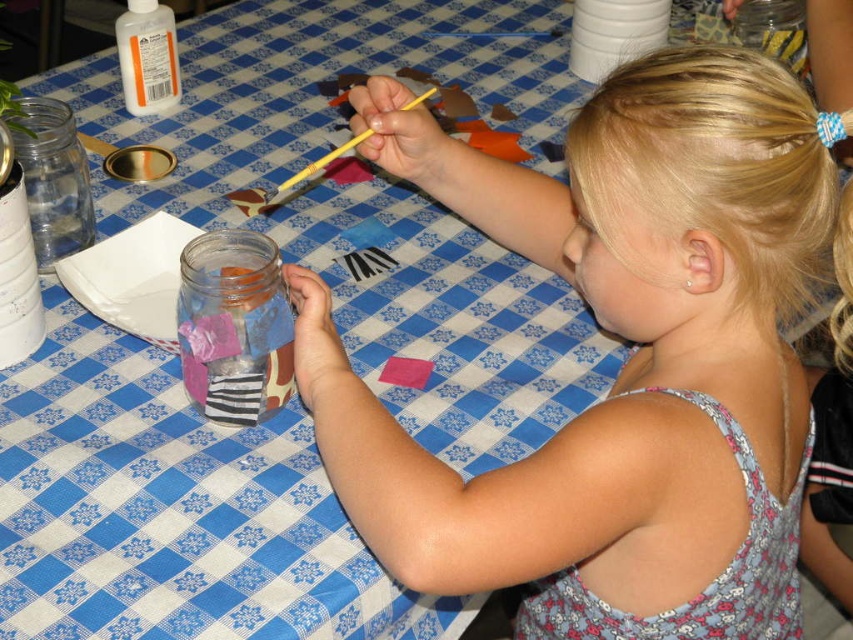
Question: Which is farther from the blonde hair at upper right?

Choices:
 (A) yellow wood pencil at upper center
 (B) transparent glass jar at center

Answer: (A)

Question: Does blonde hair at upper right appear over yellow wood pencil at upper center?

Choices:
 (A) no
 (B) yes

Answer: (A)

Question: Can you confirm if transparent glass jar at center is smaller than clear glass jar at left?

Choices:
 (A) yes
 (B) no

Answer: (A)

Question: Which point is closer to the camera taking this photo?

Choices:
 (A) (688, 316)
 (B) (186, 244)
 (C) (271, 198)
 (D) (74, 230)

Answer: (A)

Question: Can you confirm if transparent glass jar at center is positioned below clear glass jar at left?

Choices:
 (A) yes
 (B) no

Answer: (A)

Question: Which object appears farthest from the camera in this image?

Choices:
 (A) blonde hair at upper right
 (B) transparent glass jar at center

Answer: (B)